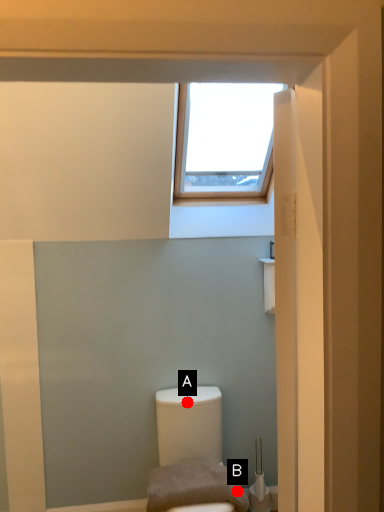
Question: Two points are circled on the image, labeled by A and B beside each circle. Which point is farther from the camera taking this photo?

Choices:
 (A) A is further
 (B) B is further

Answer: (A)